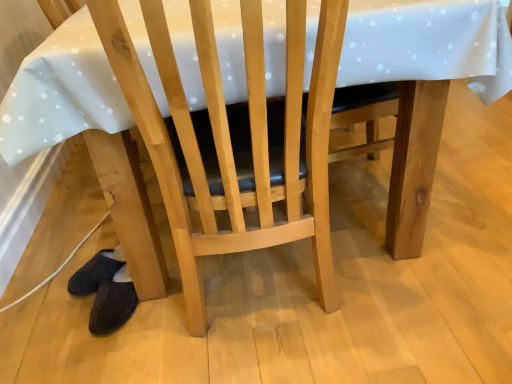
Where is `free region on the left part of wooden chair at center`? free region on the left part of wooden chair at center is located at coordinates (118, 338).